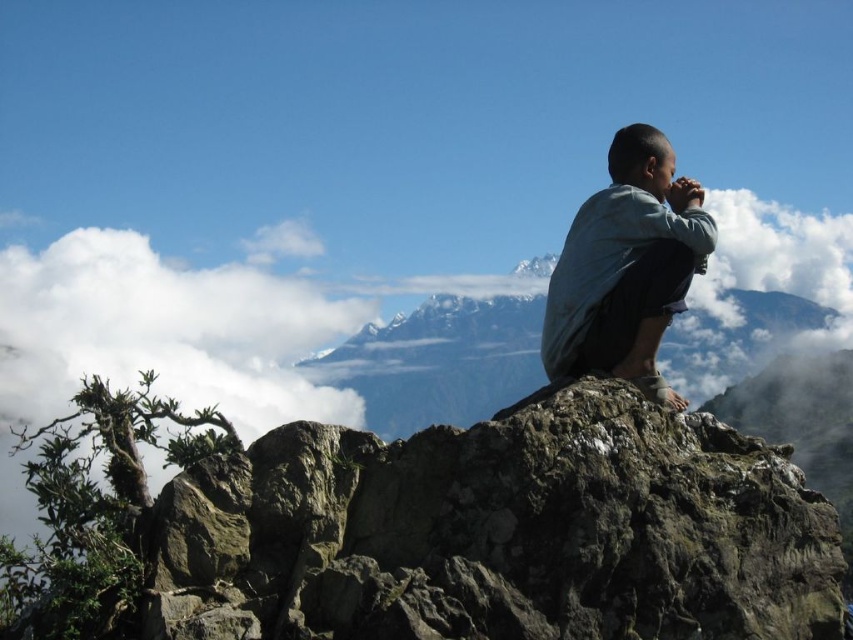
Question: Is rough textured rock at center above white fluffy cloud at upper left?

Choices:
 (A) yes
 (B) no

Answer: (A)

Question: Which point is closer to the camera taking this photo?

Choices:
 (A) (654, 179)
 (B) (608, 548)

Answer: (B)

Question: Which of these objects is positioned closest to the white fluffy cloud at upper left?

Choices:
 (A) light blue denim shirt at upper right
 (B) rough textured rock at center

Answer: (B)

Question: Can you confirm if rough textured rock at center is thinner than white fluffy cloud at upper left?

Choices:
 (A) no
 (B) yes

Answer: (B)

Question: Which of the following is the closest to the observer?

Choices:
 (A) (480, 532)
 (B) (216, 288)
 (C) (653, 193)

Answer: (A)

Question: Is rough textured rock at center to the left of light blue denim shirt at upper right from the viewer's perspective?

Choices:
 (A) no
 (B) yes

Answer: (B)